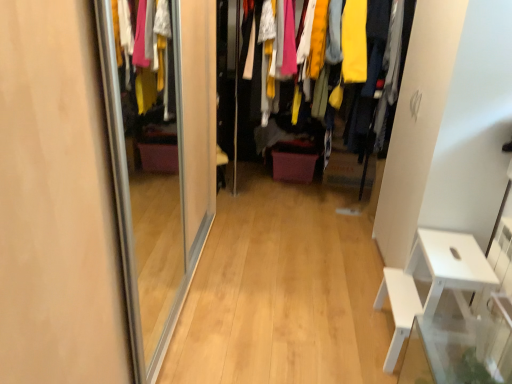
Where is `white plastic table at right`? Image resolution: width=512 pixels, height=384 pixels. white plastic table at right is located at coordinates (431, 280).

What is the approximate width of white plastic table at right?

It is 15.64 inches.

What do you see at coordinates (431, 280) in the screenshot? I see `white plastic table at right` at bounding box center [431, 280].

This screenshot has height=384, width=512. What do you see at coordinates (249, 90) in the screenshot?
I see `textured fabric clothes at center` at bounding box center [249, 90].

In order to face textured fabric clothes at center, should I rotate leftwards or rightwards?

Rotate right and turn 10.256 degrees.

I want to click on textured fabric clothes at center, so click(249, 90).

Locate an element on the screen. This screenshot has width=512, height=384. white plastic table at right is located at coordinates (431, 280).

Would you say textured fabric clothes at center is to the left or to the right of white plastic table at right in the picture?

textured fabric clothes at center is to the left of white plastic table at right.

Is textured fabric clothes at center further to camera compared to white plastic table at right?

Yes.

Does point (227, 147) come in front of point (453, 241)?

No, (227, 147) is further to viewer.

From the image's perspective, who appears lower, textured fabric clothes at center or white plastic table at right?

white plastic table at right, from the image's perspective.

From a real-world perspective, is textured fabric clothes at center positioned over white plastic table at right based on gravity?

Indeed, from a real-world perspective, textured fabric clothes at center stands above white plastic table at right.

In terms of width, does textured fabric clothes at center look wider or thinner when compared to white plastic table at right?

Clearly, textured fabric clothes at center has more width compared to white plastic table at right.

Consider the image. Is textured fabric clothes at center taller or shorter than white plastic table at right?

Clearly, textured fabric clothes at center is taller compared to white plastic table at right.

Based on their sizes in the image, would you say textured fabric clothes at center is bigger or smaller than white plastic table at right?

In the image, textured fabric clothes at center appears to be larger than white plastic table at right.

From the picture: Can we say textured fabric clothes at center lies outside white plastic table at right?

textured fabric clothes at center lies outside white plastic table at right's area.

Is textured fabric clothes at center in contact with white plastic table at right?

No, textured fabric clothes at center is not next to white plastic table at right.

Is textured fabric clothes at center looking in the opposite direction of white plastic table at right?

No, textured fabric clothes at center's orientation is not away from white plastic table at right.

Can you tell me how much textured fabric clothes at center and white plastic table at right differ in facing direction?

textured fabric clothes at center and white plastic table at right are facing 89.8 degrees away from each other.

Measure the distance from textured fabric clothes at center to white plastic table at right.

textured fabric clothes at center and white plastic table at right are 6.79 feet apart from each other.

At what (x,y) coordinates should I click in order to perform the action: click on furniture in front of the textured fabric clothes at center. Please return your answer as a coordinate pair (x, y). This screenshot has width=512, height=384. Looking at the image, I should click on (431, 280).

Is white plastic table at right to the left or to the right of textured fabric clothes at center in the image?

Based on their positions, white plastic table at right is located to the right of textured fabric clothes at center.

Is white plastic table at right in front of or behind textured fabric clothes at center in the image?

Clearly, white plastic table at right is in front of textured fabric clothes at center.

Between point (432, 267) and point (255, 109), which one is positioned behind?

Point (255, 109)

From the image's perspective, would you say white plastic table at right is positioned over textured fabric clothes at center?

Actually, white plastic table at right appears below textured fabric clothes at center in the image.

From a real-world perspective, is white plastic table at right over textured fabric clothes at center?

No, from a real-world perspective, white plastic table at right is not over textured fabric clothes at center

Does white plastic table at right have a lesser width compared to textured fabric clothes at center?

Correct, the width of white plastic table at right is less than that of textured fabric clothes at center.

Between white plastic table at right and textured fabric clothes at center, which one has less height?

Standing shorter between the two is white plastic table at right.

Considering the relative sizes of white plastic table at right and textured fabric clothes at center in the image provided, is white plastic table at right smaller than textured fabric clothes at center?

Correct, white plastic table at right occupies less space than textured fabric clothes at center.

Is white plastic table at right spatially inside textured fabric clothes at center, or outside of it?

white plastic table at right is outside textured fabric clothes at center.

Is white plastic table at right in contact with textured fabric clothes at center?

No, white plastic table at right is not next to textured fabric clothes at center.

Is white plastic table at right turned away from textured fabric clothes at center?

No, textured fabric clothes at center is not at the back of white plastic table at right.

What's the angular difference between white plastic table at right and textured fabric clothes at center's facing directions?

There is a 89.8-degree angle between the facing directions of white plastic table at right and textured fabric clothes at center.

How far apart are white plastic table at right and textured fabric clothes at center?

6.79 feet.

This screenshot has height=384, width=512. Find the location of `furniture below the textured fabric clothes at center (from the image's perspective)`. furniture below the textured fabric clothes at center (from the image's perspective) is located at coordinates (431, 280).

Where is `closet on the left of white plastic table at right`? closet on the left of white plastic table at right is located at coordinates (249, 90).

There is a white plastic table at right. At what (x,y) coordinates should I click in order to perform the action: click on closet above it (from a real-world perspective). Please return your answer as a coordinate pair (x, y). Image resolution: width=512 pixels, height=384 pixels. Looking at the image, I should click on (249, 90).